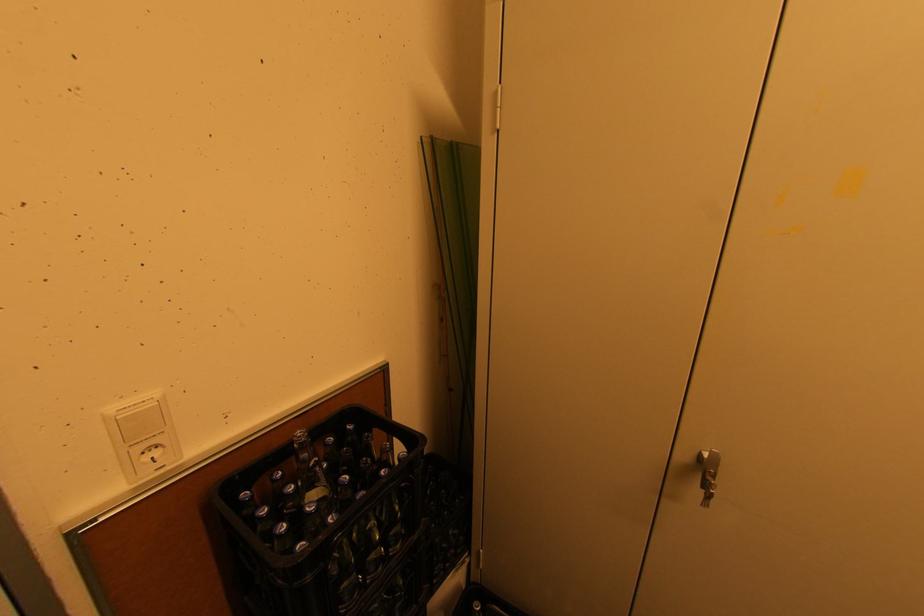
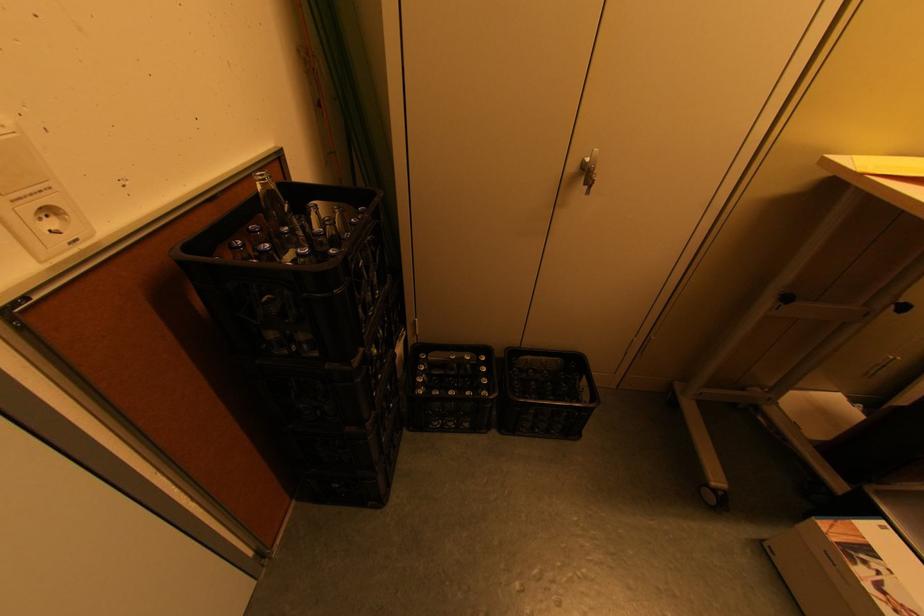
The point at [703,455] is marked in the first image. Where is the corresponding point in the second image?

(587, 161)